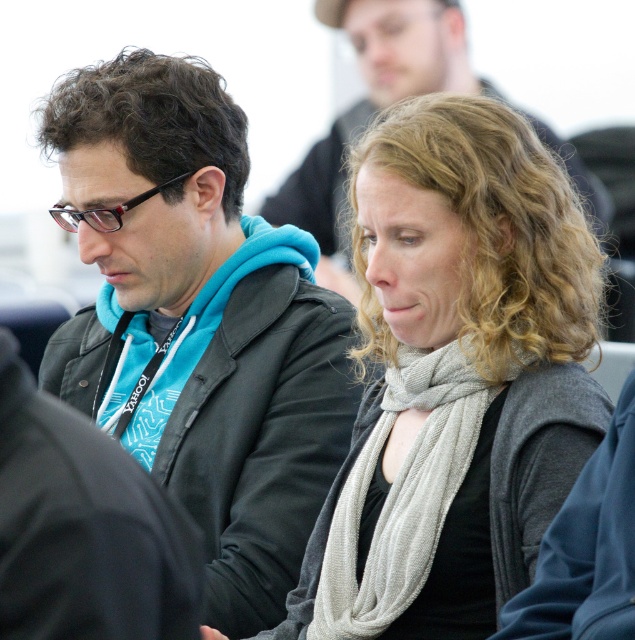
How much distance is there between gray knitted scarf at center and matte black jacket at center?

They are 61.33 feet apart.

Is point (396, 593) positioned after point (394, 74)?

No, (396, 593) is in front of (394, 74).

You are a GUI agent. You are given a task and a screenshot of the screen. Output one action in this format:
    pyautogui.click(x=<x>, y=<y>)
    Task: Click on the gray knitted scarf at center
    Image resolution: width=635 pixels, height=640 pixels.
    Given the screenshot: What is the action you would take?
    pyautogui.click(x=401, y=492)

Does matte black jacket at left have a greater width compared to light gray scarf at center?

Yes, matte black jacket at left is wider than light gray scarf at center.

Is point (288, 442) closer to viewer compared to point (479, 132)?

That is False.

I want to click on matte black jacket at left, so click(x=201, y=321).

Who is more forward, (x=231, y=168) or (x=333, y=161)?

Point (x=231, y=168) is in front.

Is the position of matte black jacket at left less distant than that of matte black jacket at center?

Yes, matte black jacket at left is in front of matte black jacket at center.

Identify the location of matte black jacket at left. This screenshot has height=640, width=635. pyautogui.click(x=201, y=321).

I want to click on matte black jacket at left, so click(x=201, y=321).